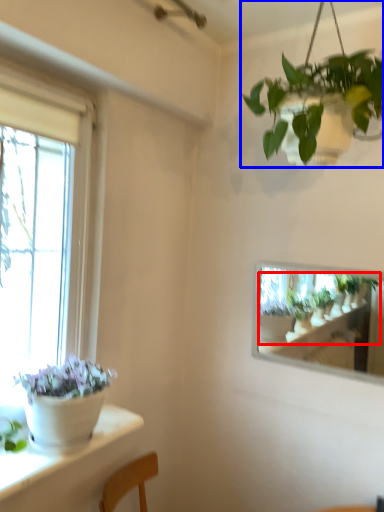
Question: Which object is closer to the camera taking this photo, houseplant (highlighted by a red box) or houseplant (highlighted by a blue box)?

Choices:
 (A) houseplant
 (B) houseplant

Answer: (B)